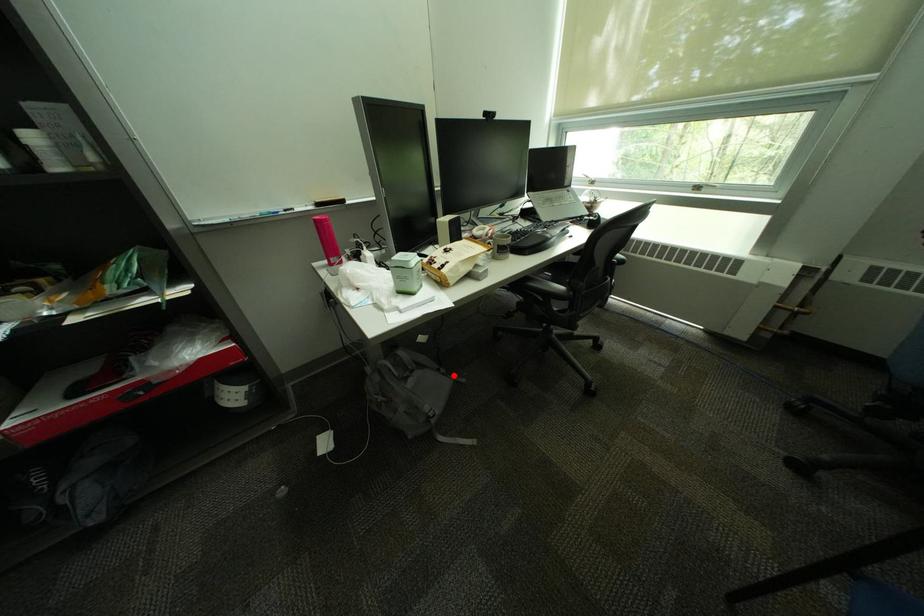
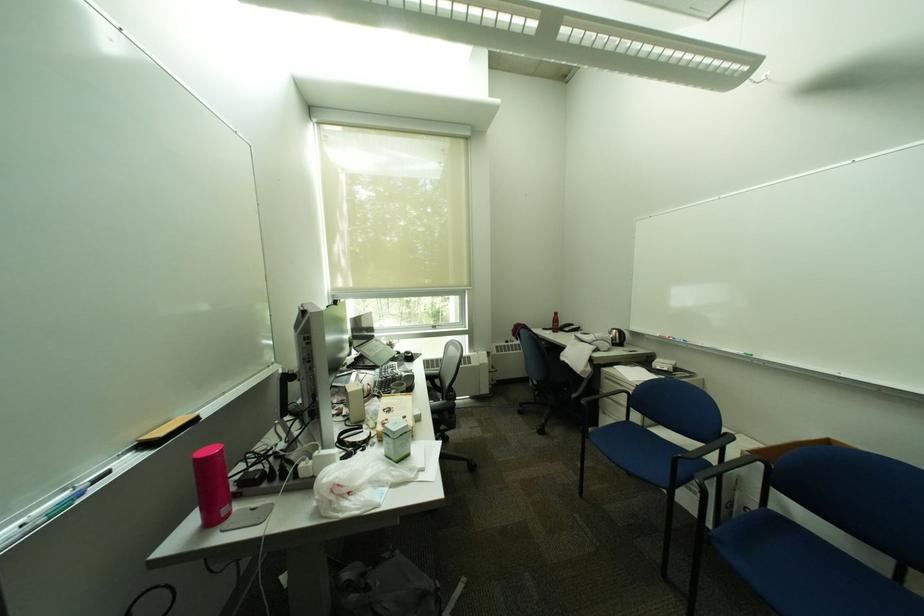
Question: I am providing you with two images of the same scene from different viewpoints. Image1 has a red point marked. In image2, the corresponding 3D location appears at what relative position? Reply with the corresponding letter.

Choices:
 (A) Closer
 (B) Farther

Answer: (A)